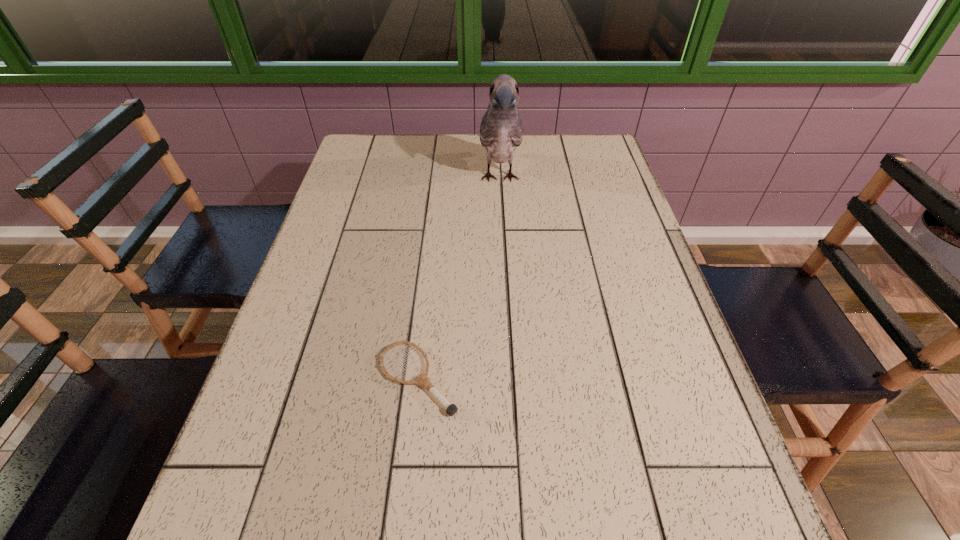
At what (x,y) coordinates should I click in order to perform the action: click on vacant space at the far right corner. Please return your answer as a coordinate pair (x, y). The height and width of the screenshot is (540, 960). Looking at the image, I should click on pyautogui.click(x=612, y=158).